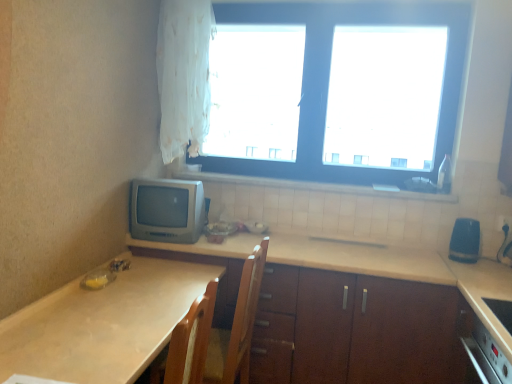
Question: In which direction should I rotate to look at beige laminate countertop at center, which is counted as the second countertop, starting from the left?

Choices:
 (A) right
 (B) left

Answer: (A)

Question: Is matte gray crt monitor at left, the 1th appliance from the left, directly adjacent to white tile at upper center?

Choices:
 (A) no
 (B) yes

Answer: (A)

Question: Is matte gray crt monitor at left, the second appliance viewed from the right, taller than white tile at upper center?

Choices:
 (A) no
 (B) yes

Answer: (B)

Question: Is white tile at upper center surrounded by matte gray crt monitor at left, the second appliance viewed from the right?

Choices:
 (A) yes
 (B) no

Answer: (B)

Question: Is matte gray crt monitor at left, the second appliance viewed from the right, not inside white tile at upper center?

Choices:
 (A) no
 (B) yes

Answer: (B)

Question: Is matte gray crt monitor at left, the second appliance viewed from the right, bigger than white tile at upper center?

Choices:
 (A) no
 (B) yes

Answer: (B)

Question: From the image's perspective, is matte gray crt monitor at left, the 1th appliance from the left, located beneath white tile at upper center?

Choices:
 (A) yes
 (B) no

Answer: (A)

Question: From the image's perspective, does white tile at upper center appear lower than blue rubber eraser at right, placed as the first appliance when sorted from right to left?

Choices:
 (A) yes
 (B) no

Answer: (B)

Question: Considering the relative sizes of white tile at upper center and blue rubber eraser at right, placed as the first appliance when sorted from right to left, in the image provided, is white tile at upper center taller than blue rubber eraser at right, placed as the first appliance when sorted from right to left,?

Choices:
 (A) no
 (B) yes

Answer: (A)

Question: Considering the relative sizes of white tile at upper center and blue rubber eraser at right, placed as the first appliance when sorted from right to left, in the image provided, is white tile at upper center wider than blue rubber eraser at right, placed as the first appliance when sorted from right to left,?

Choices:
 (A) yes
 (B) no

Answer: (B)

Question: Is white tile at upper center in contact with blue rubber eraser at right, which is the second appliance from left to right?

Choices:
 (A) no
 (B) yes

Answer: (A)

Question: From a real-world perspective, is white tile at upper center positioned over blue rubber eraser at right, which is the second appliance from left to right, based on gravity?

Choices:
 (A) no
 (B) yes

Answer: (B)

Question: Is blue rubber eraser at right, placed as the first appliance when sorted from right to left, a part of white tile at upper center?

Choices:
 (A) no
 (B) yes

Answer: (A)

Question: Is beige laminate countertop at lower left, positioned as the 2th countertop in right-to-left order, at the left side of white sheer curtain at upper left?

Choices:
 (A) yes
 (B) no

Answer: (A)